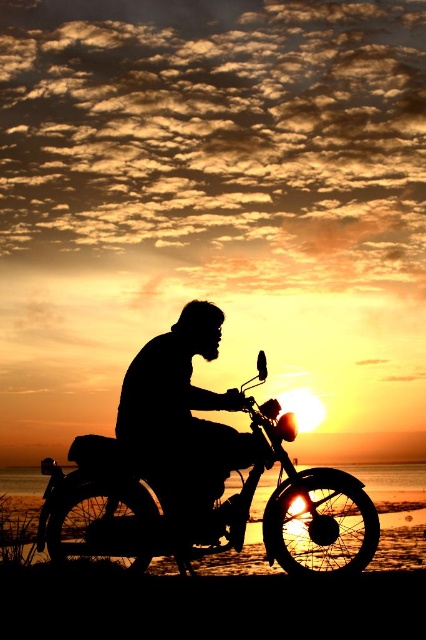
In the scene shown: You are a photographer trying to capture the silhouette man at center and the black matte dirt bike at center in a single frame. Based on their positions, which object is closer to the camera?

The black matte dirt bike at center is positioned under the silhouette man at center, so the silhouette man at center is closer to the camera.

Consider the image. You are a photographer who wants to capture the silhouette man at center and the smooth sand at lower center in the same frame. Given that your camera has a minimum focus distance of 5 feet, will you be able to achieve this without moving closer?

The distance between the silhouette man at center and the smooth sand at lower center is 6.71 feet, which is greater than the camera minimum focus distance of 5 feet. Therefore, you can capture both in the same frame without moving closer.

Consider the image. You are a photographer aiming to capture the motorcycle in the scene. You want to ensure that the black matte dirt bike at center is positioned exactly 6 feet away from the smooth sand at lower center. Based on the current setup, is the motorcycle already at the desired distance?

The distance between the black matte dirt bike at center and the smooth sand at lower center is 5.93 feet, which is just slightly less than the desired 6 feet. The motorcycle is almost at the correct distance but needs to be moved approximately 0.07 feet forward to meet the exact requirement.